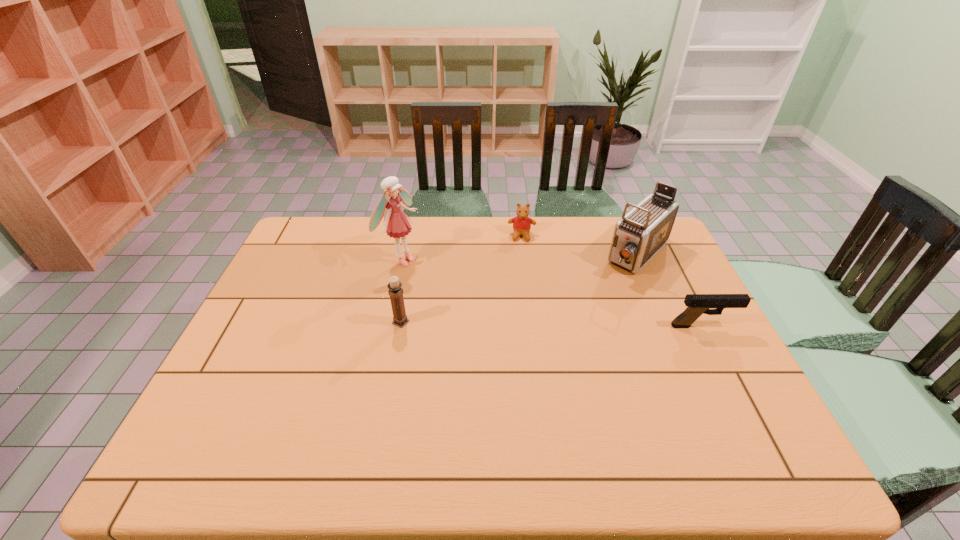
You are a GUI agent. You are given a task and a screenshot of the screen. Output one action in this format:
    pyautogui.click(x=<x>, y=<y>)
    Task: Click on the object present at the far right corner
    
    Given the screenshot: What is the action you would take?
    pyautogui.click(x=640, y=233)

The height and width of the screenshot is (540, 960). In order to click on free region at the far edge of the desktop in this screenshot , I will do `click(505, 218)`.

This screenshot has height=540, width=960. In order to click on vacant space at the near edge in this screenshot , I will do `click(656, 403)`.

Locate an element on the screen. Image resolution: width=960 pixels, height=540 pixels. free space at the left edge of the desktop is located at coordinates (288, 353).

The height and width of the screenshot is (540, 960). In the image, there is a desktop. What are the coordinates of `blank space at the right edge` in the screenshot? It's located at (675, 293).

Where is `vacant space at the far left corner of the desktop`? This screenshot has height=540, width=960. vacant space at the far left corner of the desktop is located at coordinates (300, 237).

At what (x,y) coordinates should I click in order to perform the action: click on vacant space at the near right corner of the desktop. Please return your answer as a coordinate pair (x, y). Looking at the image, I should click on (724, 424).

The height and width of the screenshot is (540, 960). Find the location of `vacant space that's between the camcorder and the tallest object`. vacant space that's between the camcorder and the tallest object is located at coordinates (520, 257).

Locate an element on the screen. The height and width of the screenshot is (540, 960). vacant region between the doll and the teddy bear is located at coordinates (462, 247).

Where is `vacant area between the fourth shortest object and the third shortest object`? This screenshot has height=540, width=960. vacant area between the fourth shortest object and the third shortest object is located at coordinates (520, 288).